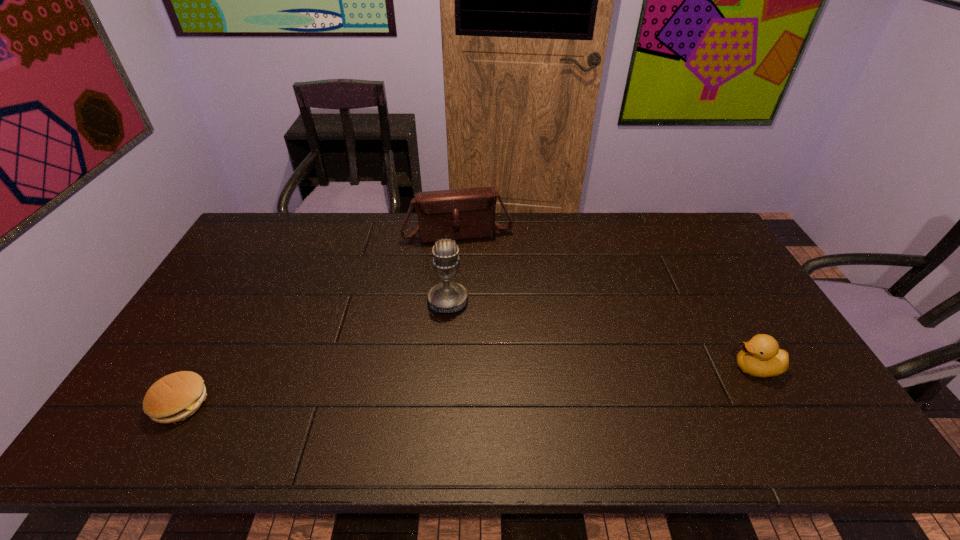
Locate an element on the screen. Image resolution: width=960 pixels, height=540 pixels. patty is located at coordinates (174, 397).

You are a GUI agent. You are given a task and a screenshot of the screen. Output one action in this format:
    pyautogui.click(x=<x>, y=<y>)
    Task: Click on the leftmost object
    
    Given the screenshot: What is the action you would take?
    pyautogui.click(x=174, y=397)

Where is `the rightmost object`? The image size is (960, 540). the rightmost object is located at coordinates (760, 357).

I want to click on duckling, so click(x=760, y=357).

The height and width of the screenshot is (540, 960). What are the coordinates of `the farthest object` in the screenshot? It's located at 459,214.

This screenshot has height=540, width=960. Find the location of `the second tallest object`. the second tallest object is located at coordinates (459, 214).

The image size is (960, 540). I want to click on microphone, so click(448, 297).

Locate an element on the screen. The width and height of the screenshot is (960, 540). the third nearest object is located at coordinates (448, 297).

I want to click on vacant area situated 0.360m on the back of the leftmost object, so click(x=248, y=285).

Locate an element on the screen. free location located on the face of the second shortest object is located at coordinates (616, 368).